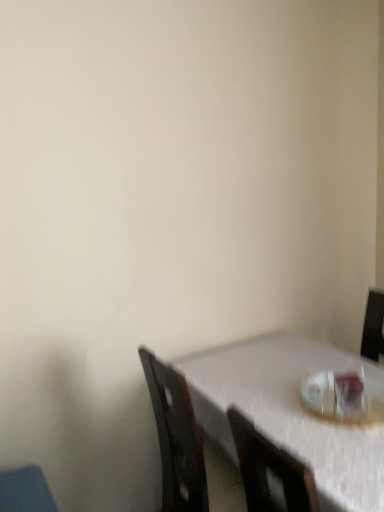
Question: From the image's perspective, is white textured table at lower right over transparent plastic cup at lower right?

Choices:
 (A) no
 (B) yes

Answer: (A)

Question: From the image's perspective, does white textured table at lower right appear lower than transparent plastic cup at lower right?

Choices:
 (A) no
 (B) yes

Answer: (B)

Question: From a real-world perspective, is white textured table at lower right on transparent plastic cup at lower right?

Choices:
 (A) yes
 (B) no

Answer: (B)

Question: Is white textured table at lower right located outside transparent plastic cup at lower right?

Choices:
 (A) no
 (B) yes

Answer: (B)

Question: Is transparent plastic cup at lower right at the back of white textured table at lower right?

Choices:
 (A) no
 (B) yes

Answer: (A)

Question: Is white textured table at lower right bigger than transparent plastic cup at lower right?

Choices:
 (A) yes
 (B) no

Answer: (A)

Question: From a real-world perspective, does transparent plastic cup at lower right sit lower than white textured table at lower right?

Choices:
 (A) yes
 (B) no

Answer: (B)

Question: Can you see transparent plastic cup at lower right touching white textured table at lower right?

Choices:
 (A) no
 (B) yes

Answer: (A)

Question: Is transparent plastic cup at lower right facing towards white textured table at lower right?

Choices:
 (A) no
 (B) yes

Answer: (A)

Question: Can you confirm if transparent plastic cup at lower right is positioned to the right of white textured table at lower right?

Choices:
 (A) no
 (B) yes

Answer: (B)

Question: Is transparent plastic cup at lower right wider than white textured table at lower right?

Choices:
 (A) yes
 (B) no

Answer: (B)

Question: From the image's perspective, is transparent plastic cup at lower right located beneath white textured table at lower right?

Choices:
 (A) no
 (B) yes

Answer: (A)

Question: Based on their sizes in the image, would you say transparent plastic cup at lower right is bigger or smaller than white textured table at lower right?

Choices:
 (A) small
 (B) big

Answer: (A)